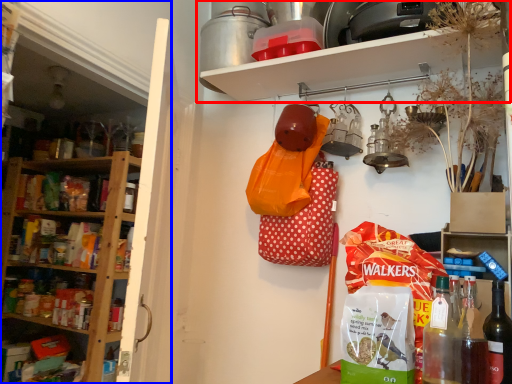
Question: Among these objects, which one is farthest to the camera, shelf (highlighted by a red box) or shelf (highlighted by a blue box)?

Choices:
 (A) shelf
 (B) shelf

Answer: (A)